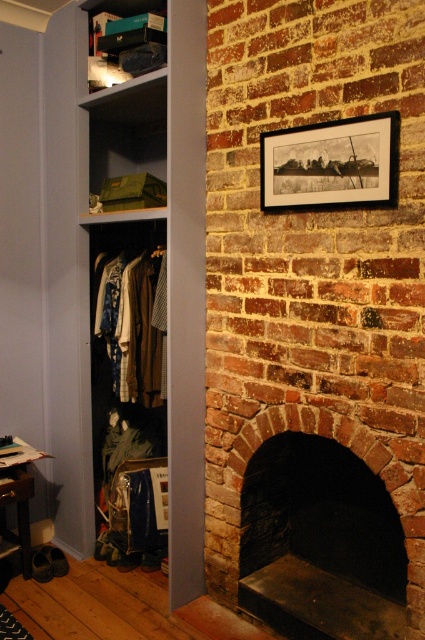
Question: Among these points, which one is nearest to the camera?

Choices:
 (A) coord(340,156)
 (B) coord(62,83)
 (C) coord(129,65)
 (D) coord(118,387)

Answer: (A)

Question: Which point appears farthest from the camera in this image?

Choices:
 (A) (328, 156)
 (B) (416, 602)
 (C) (204, 282)

Answer: (C)

Question: Does black matte picture frame at upper center have a smaller size compared to brick fireplace at center?

Choices:
 (A) no
 (B) yes

Answer: (B)

Question: Which point is closer to the camera taking this photo?

Choices:
 (A) coord(122,8)
 (B) coord(345,416)
 (C) coord(325,170)

Answer: (C)

Question: Observing the image, what is the correct spatial positioning of brick fireplace at center in reference to matte brown coat at left?

Choices:
 (A) left
 (B) right

Answer: (B)

Question: Does brick fireplace at center appear on the left side of matte black shoebox at upper left?

Choices:
 (A) no
 (B) yes

Answer: (A)